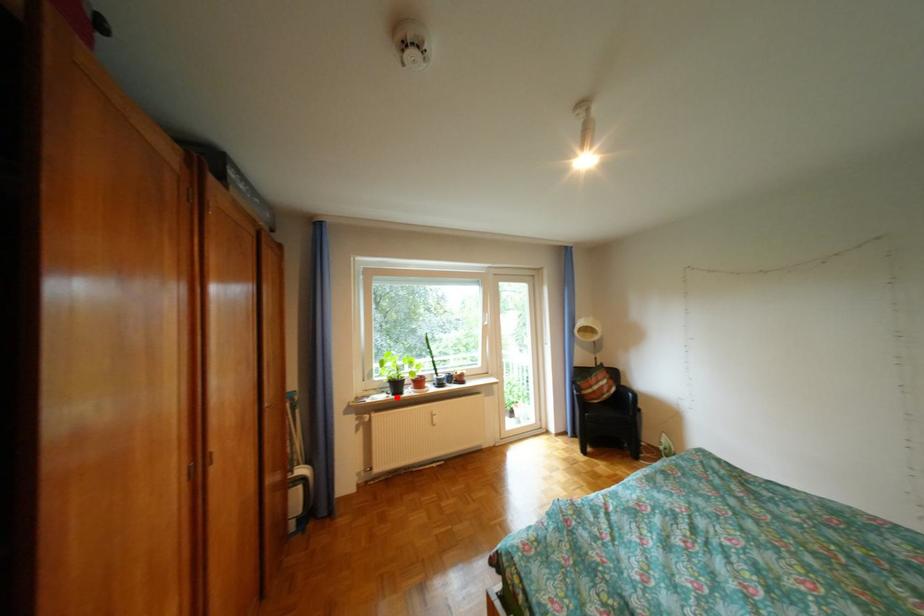
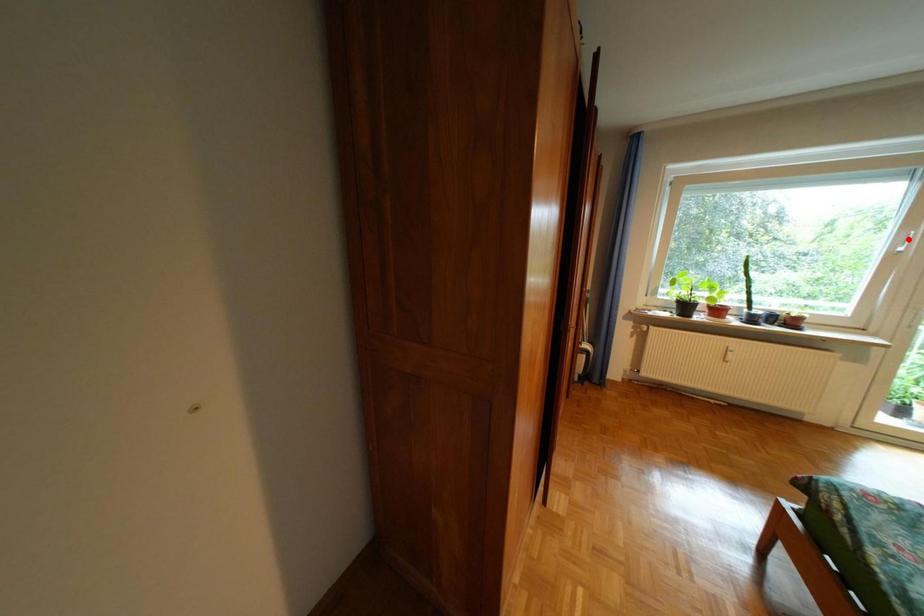
I am providing you with two images of the same scene from different viewpoints. A red point is marked on the first image and another point is marked on the second image. Is the marked point in image1 the same physical position as the marked point in image2?

No